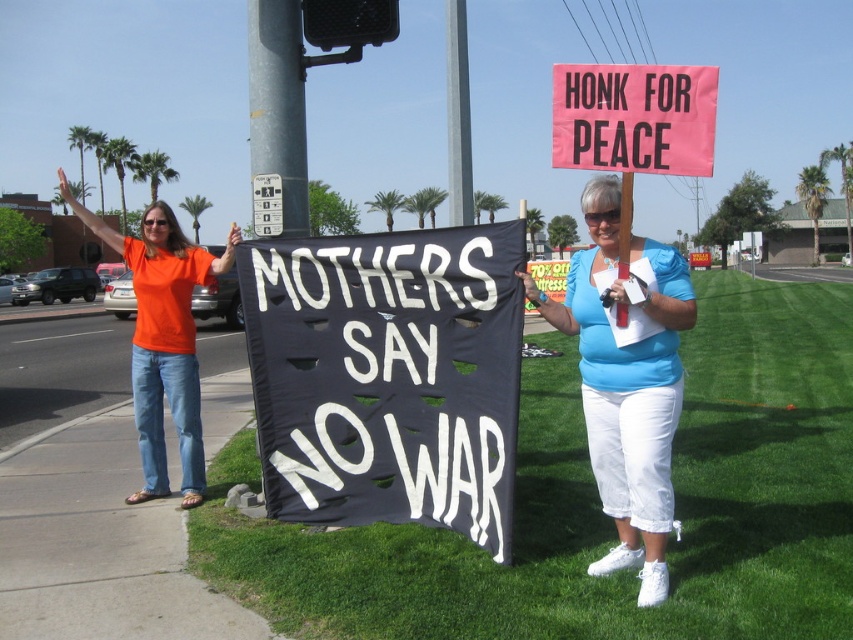
You are a photographer standing at the edge of the sidewalk. You want to take a photo of the pink paper sign at upper center and the metallic gray pole at center. Can you fit both objects in your camera frame if your camera has a maximum horizontal field of view of 2 meters?

The distance between the pink paper sign at upper center and the metallic gray pole at center is 2.51 meters, which exceeds the camera frame of 2 meters. Therefore, both objects cannot be captured in the same photo.

Consider the image. You are a photographer aiming to capture a clear shot of the pink paper sign at upper center. Based on its position coordinates, where should you focus your camera?

The pink paper sign at upper center is located at coordinates point (x=634, y=116), so you should focus your camera at that position to capture it clearly.

You are planning to install a new streetlight near the gray concrete pole at upper center. Based on the image, what is the exact coordinate where the pole is located?

The gray concrete pole at upper center is located at point (457, 115).